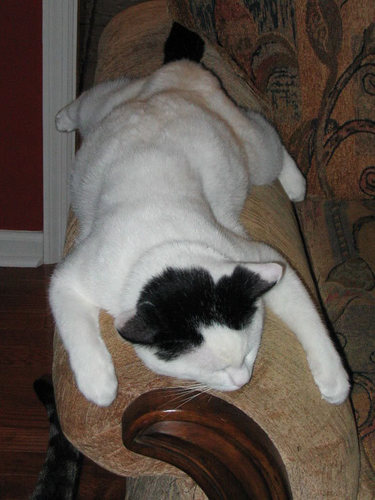
Where is `reflection on wood`? reflection on wood is located at coordinates (170, 410).